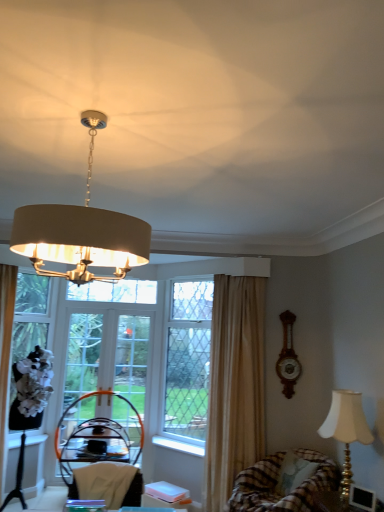
Question: Is matte beige lampshade at upper center, placed as the 1th lamp when sorted from left to right, surrounded by white plastic window sill at lower center, the 2th window sill viewed from the left?

Choices:
 (A) yes
 (B) no

Answer: (B)

Question: Does white plastic window sill at lower center, the 2th window sill viewed from the left, come in front of matte beige lampshade at upper center, which is the first lamp from top to bottom?

Choices:
 (A) no
 (B) yes

Answer: (A)

Question: Can you confirm if white plastic window sill at lower center, marked as the 1th window sill in a right-to-left arrangement, is shorter than matte beige lampshade at upper center, the first lamp positioned from the front?

Choices:
 (A) yes
 (B) no

Answer: (A)

Question: Can we say white plastic window sill at lower center, the 2th window sill viewed from the left, lies outside matte beige lampshade at upper center, the first lamp positioned from the front?

Choices:
 (A) no
 (B) yes

Answer: (B)

Question: Are white plastic window sill at lower center, marked as the 1th window sill in a right-to-left arrangement, and matte beige lampshade at upper center, which is the first lamp from top to bottom, located far from each other?

Choices:
 (A) yes
 (B) no

Answer: (A)

Question: Is white plastic window sill at lower center, the 2th window sill viewed from the left, directly adjacent to matte beige lampshade at upper center, which is the first lamp from top to bottom?

Choices:
 (A) no
 (B) yes

Answer: (A)

Question: Does matte beige lampshade at upper center, which is the 2th lamp in back-to-front order, have a larger size compared to clear glass door at center, the 2th screen door positioned from the left?

Choices:
 (A) no
 (B) yes

Answer: (B)

Question: From a real-world perspective, does matte beige lampshade at upper center, which appears as the second lamp when ordered from the bottom, sit lower than clear glass door at center, the 2th screen door positioned from the left?

Choices:
 (A) yes
 (B) no

Answer: (B)

Question: Considering the relative sizes of matte beige lampshade at upper center, placed as the 1th lamp when sorted from left to right, and clear glass door at center, the 2th screen door positioned from the left, in the image provided, is matte beige lampshade at upper center, placed as the 1th lamp when sorted from left to right, shorter than clear glass door at center, the 2th screen door positioned from the left,?

Choices:
 (A) no
 (B) yes

Answer: (B)

Question: Does matte beige lampshade at upper center, placed as the 1th lamp when sorted from left to right, have a lesser width compared to clear glass door at center, which is the first screen door from right to left?

Choices:
 (A) no
 (B) yes

Answer: (A)

Question: Does matte beige lampshade at upper center, which appears as the second lamp when ordered from the bottom, have a greater height compared to clear glass door at center, which is the first screen door from right to left?

Choices:
 (A) no
 (B) yes

Answer: (A)

Question: Is matte beige lampshade at upper center, which is the 2th lamp in back-to-front order, outside of clear glass door at center, which is the first screen door from right to left?

Choices:
 (A) no
 (B) yes

Answer: (B)

Question: Does white fabric armchair at lower center, positioned as the 1th armchair in top-to-bottom order, have a greater height compared to clear glass window screen at left, acting as the first window screen starting from the left?

Choices:
 (A) yes
 (B) no

Answer: (B)